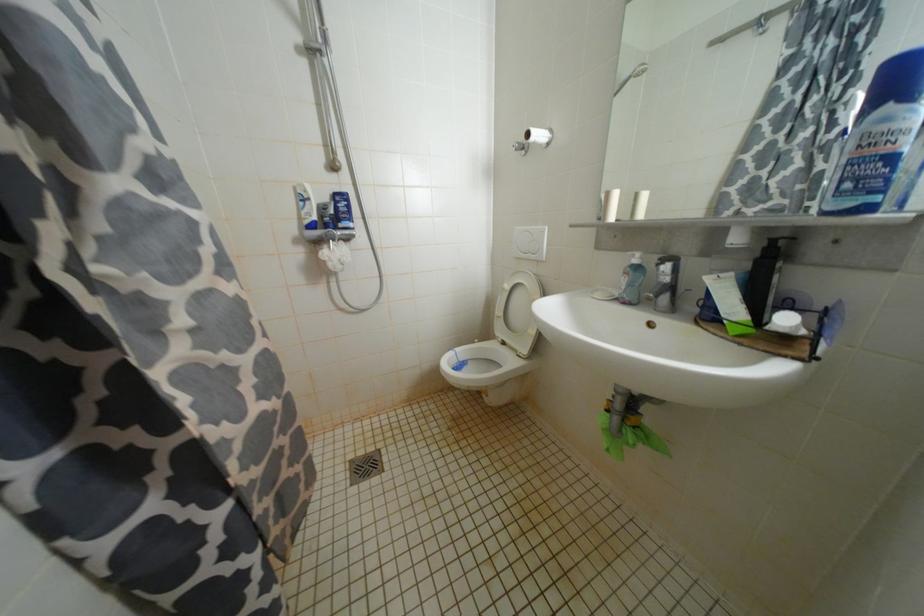
This screenshot has height=616, width=924. What do you see at coordinates (784, 238) in the screenshot? I see `the black dispenser pump` at bounding box center [784, 238].